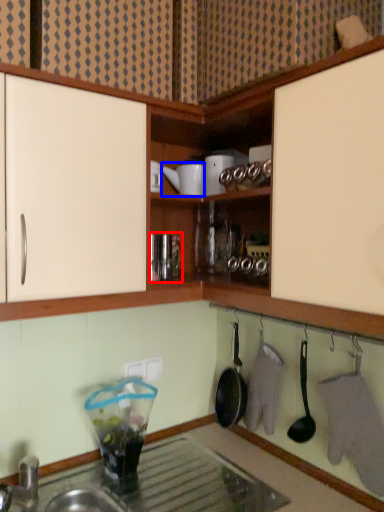
Question: Which point is further to the camera, appliance (highlighted by a red box) or appliance (highlighted by a blue box)?

Choices:
 (A) appliance
 (B) appliance

Answer: (B)